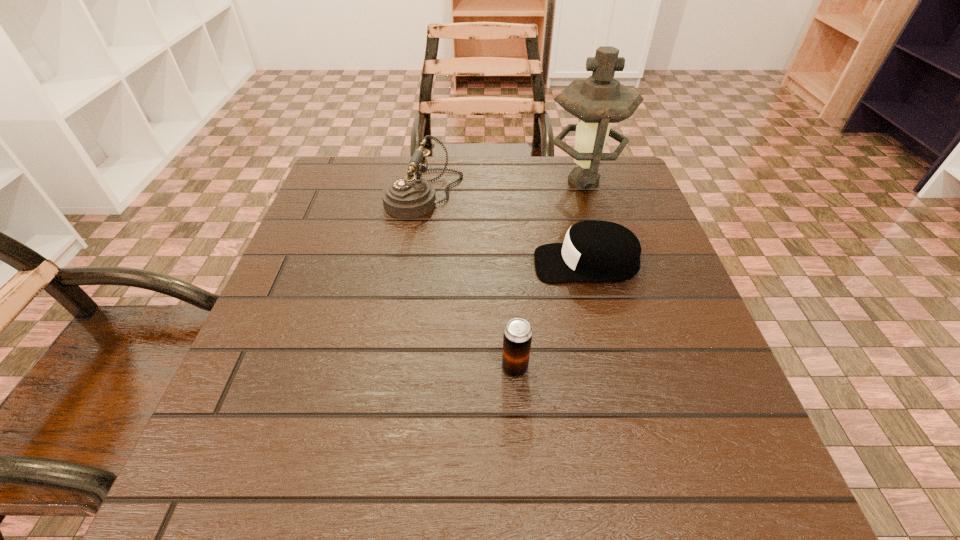
The width and height of the screenshot is (960, 540). I want to click on free region located on the front-facing side of the cap, so click(465, 264).

Locate an element on the screen. vacant point located on the front-facing side of the cap is located at coordinates (469, 264).

At what (x,y) coordinates should I click in order to perform the action: click on vacant space located 0.110m on the front-facing side of the cap. Please return your answer as a coordinate pair (x, y). Looking at the image, I should click on 480,264.

The width and height of the screenshot is (960, 540). I want to click on oil lamp that is at the far edge, so click(x=599, y=100).

Locate an element on the screen. telephone that is at the far edge is located at coordinates (408, 197).

Find the location of `object that is at the left edge`. object that is at the left edge is located at coordinates (408, 197).

The image size is (960, 540). I want to click on oil lamp positioned at the right edge, so click(x=599, y=100).

Locate an element on the screen. Image resolution: width=960 pixels, height=540 pixels. cap present at the right edge is located at coordinates (597, 251).

This screenshot has height=540, width=960. In order to click on object that is at the far left corner in this screenshot , I will do `click(408, 197)`.

What are the coordinates of `object that is at the far right corner` in the screenshot? It's located at (599, 100).